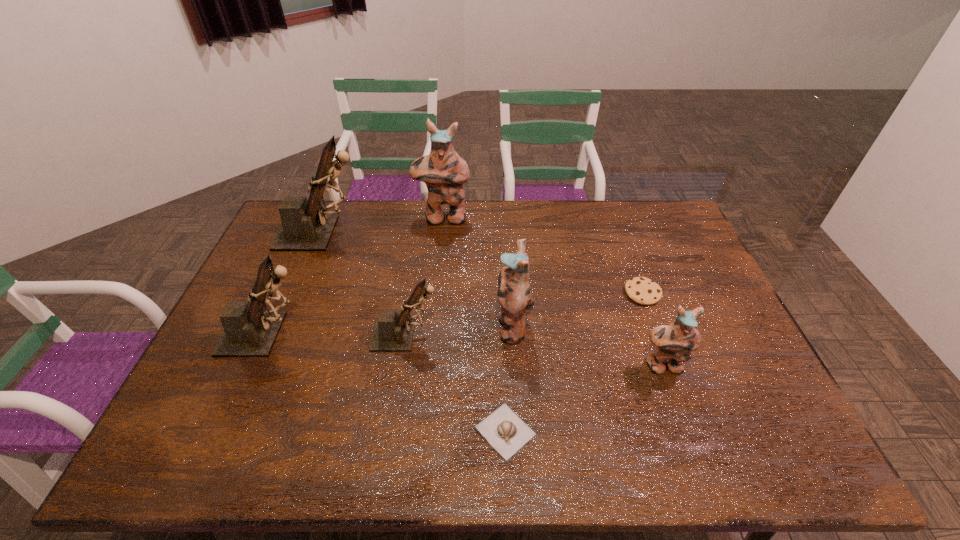
Find the location of `vacant space in between the rightmost figurine and the garlic`. vacant space in between the rightmost figurine and the garlic is located at coordinates (584, 399).

Identify the location of vacant space that is in between the rightmost brown figurine and the second biggest brown figurine. (337, 334).

Identify the location of free spot between the biggest brown figurine and the farthest pink figurine. This screenshot has width=960, height=540. (x=383, y=226).

This screenshot has height=540, width=960. Identify the location of free space between the biggest brown figurine and the second pink figurine from left to right. (418, 279).

Identify the location of vacant area between the smallest pink figurine and the second biggest brown figurine. 466,350.

Identify the location of empty location between the rightmost pink figurine and the leftmost pink figurine. (553, 292).

This screenshot has height=540, width=960. I want to click on blank region between the farthest pink figurine and the biggest brown figurine, so click(383, 226).

Image resolution: width=960 pixels, height=540 pixels. In order to click on vacant point located between the garlic and the rightmost brown figurine in this screenshot , I will do `click(456, 383)`.

This screenshot has height=540, width=960. I want to click on empty space between the cookie and the biggest brown figurine, so click(483, 263).

The height and width of the screenshot is (540, 960). I want to click on object that is the third closest to the biggest brown figurine, so click(392, 332).